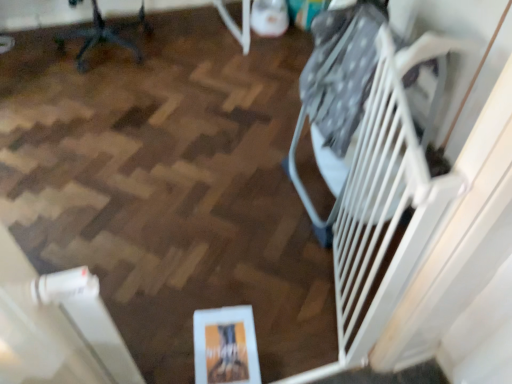
Question: Is white plastic gate at right with metallic office chair at upper left?

Choices:
 (A) no
 (B) yes

Answer: (A)

Question: Does white plastic gate at right have a lesser height compared to metallic office chair at upper left?

Choices:
 (A) yes
 (B) no

Answer: (B)

Question: Does white plastic gate at right appear on the left side of metallic office chair at upper left?

Choices:
 (A) yes
 (B) no

Answer: (B)

Question: Considering the relative sizes of white plastic gate at right and metallic office chair at upper left in the image provided, is white plastic gate at right bigger than metallic office chair at upper left?

Choices:
 (A) yes
 (B) no

Answer: (B)

Question: Is metallic office chair at upper left at the back of white plastic gate at right?

Choices:
 (A) yes
 (B) no

Answer: (B)

Question: From a real-world perspective, is white plastic gate at right positioned under metallic office chair at upper left based on gravity?

Choices:
 (A) yes
 (B) no

Answer: (B)

Question: Is metallic office chair at upper left placed right next to white plastic gate at right?

Choices:
 (A) no
 (B) yes

Answer: (A)

Question: Is metallic office chair at upper left at the right side of white plastic gate at right?

Choices:
 (A) yes
 (B) no

Answer: (B)

Question: Is there a large distance between metallic office chair at upper left and white plastic gate at right?

Choices:
 (A) no
 (B) yes

Answer: (B)

Question: From the image's perspective, is metallic office chair at upper left over white plastic gate at right?

Choices:
 (A) yes
 (B) no

Answer: (A)

Question: Does metallic office chair at upper left come behind white plastic gate at right?

Choices:
 (A) no
 (B) yes

Answer: (B)

Question: Is metallic office chair at upper left positioned with its back to white plastic gate at right?

Choices:
 (A) no
 (B) yes

Answer: (A)

Question: Visually, is white plastic gate at right positioned to the left or to the right of metallic office chair at upper left?

Choices:
 (A) left
 (B) right

Answer: (B)